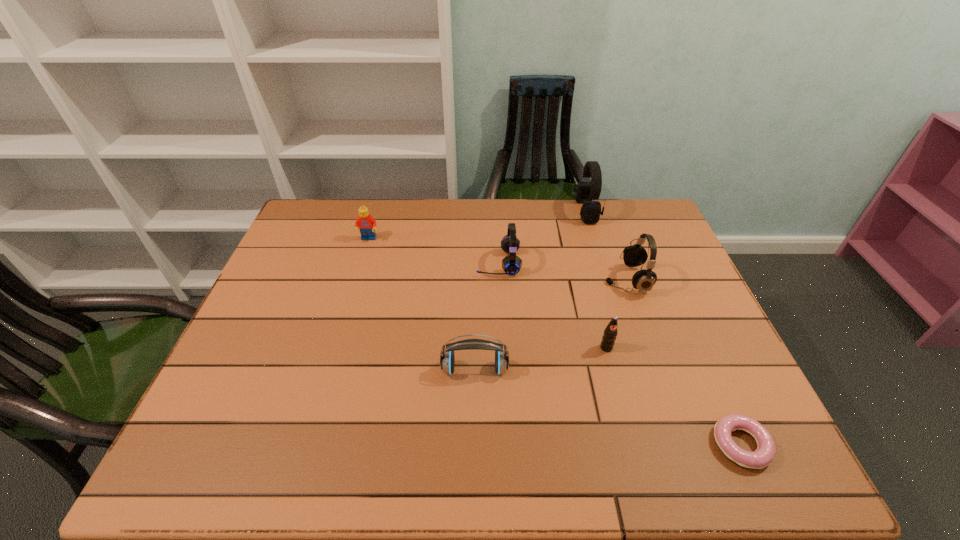
This screenshot has width=960, height=540. What are the coordinates of `vacant space located on the headband of the farthest headset` in the screenshot? It's located at (538, 212).

This screenshot has width=960, height=540. Identify the location of free point located on the headband of the farthest headset. (483, 212).

Locate an element on the screen. This screenshot has width=960, height=540. vacant space located on the face of the leftmost object is located at coordinates (345, 320).

Find the location of a particular element. This screenshot has height=540, width=960. vacant space located on the ear cups of the nearest headset is located at coordinates (474, 459).

Locate an element on the screen. The height and width of the screenshot is (540, 960). free space located on the front label of the third nearest object is located at coordinates (620, 399).

What are the coordinates of `vacant area located on the back of the doughnut` in the screenshot? It's located at (694, 340).

Where is `headset located in the far edge section of the desktop`? headset located in the far edge section of the desktop is located at coordinates (590, 212).

Image resolution: width=960 pixels, height=540 pixels. Identify the location of Lego at the far edge. (367, 224).

Find the location of a particular element. The width and height of the screenshot is (960, 540). object that is at the near edge is located at coordinates (764, 455).

Find the location of `headset positioned at the right edge`. headset positioned at the right edge is located at coordinates (643, 280).